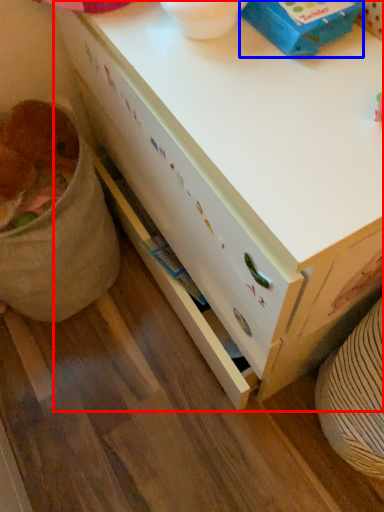
Question: Which object is closer to the camera taking this photo, desk (highlighted by a red box) or box (highlighted by a blue box)?

Choices:
 (A) desk
 (B) box

Answer: (A)